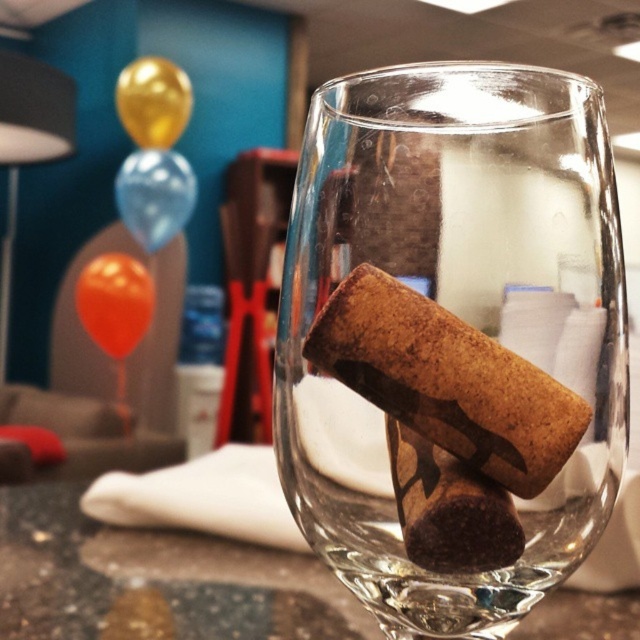
You are standing in front of the wine glass with corks. There are two points marked in the image. Which point is closer to you, point (x=428, y=609) or point (x=129, y=323)?

Point (x=428, y=609) is closer to the viewer than point (x=129, y=323).

You are arranging a party and need to place a gold metallic balloon at upper left on the translucent glass table at center. Will the balloon fit on the table?

The translucent glass table at center is bigger than the gold metallic balloon at upper left, so the balloon will fit on the table.

You are trying to place a small coaster under the transparent glass at center. Given that the coaster has a diameter of 10 cm, can you determine if the coaster will fit perfectly under the glass without overlapping the edge?

The transparent glass at center is located at point (456, 314), but without knowing the dimensions of the countertop or the position of the coaster relative to the glass, it is impossible to determine if the coaster will fit perfectly under the glass without overlapping the edge.